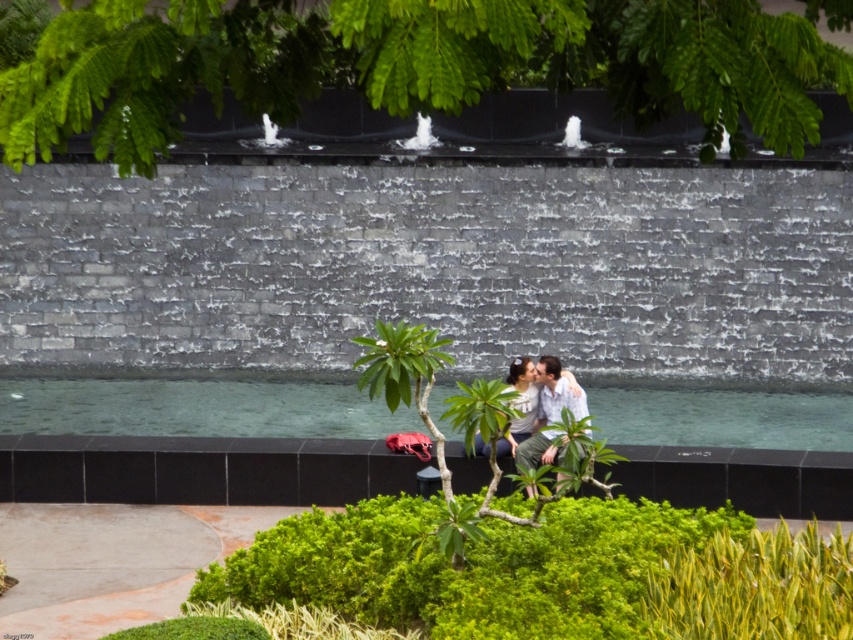
Can you confirm if green leafy tree at upper center is positioned above matte white shirt at center?

Yes.

Who is positioned more to the left, green leafy tree at upper center or matte white shirt at center?

green leafy tree at upper center is more to the left.

Which is behind, point (349, 51) or point (531, 465)?

The point (531, 465) is behind.

You are a GUI agent. You are given a task and a screenshot of the screen. Output one action in this format:
    pyautogui.click(x=<x>, y=<y>)
    Task: Click on the green leafy tree at upper center
    This screenshot has width=853, height=640.
    Given the screenshot: What is the action you would take?
    pyautogui.click(x=415, y=64)